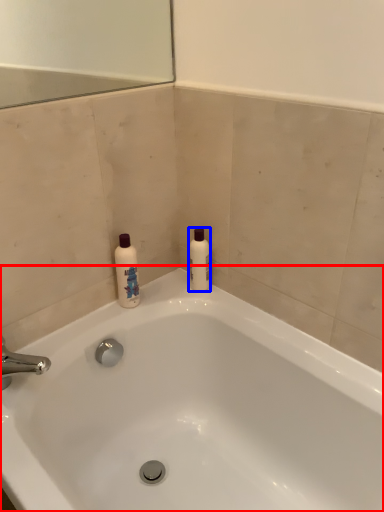
Question: Which of the following is the closest to the observer, bathtub (highlighted by a red box) or cleaning product (highlighted by a blue box)?

Choices:
 (A) bathtub
 (B) cleaning product

Answer: (A)